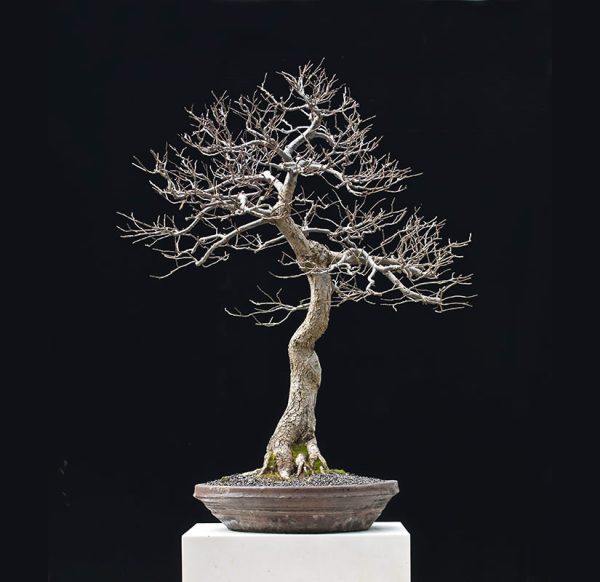
At what (x,y) coordinates should I click in order to perform the action: click on bonsai. Please return your answer as a coordinate pair (x, y). Looking at the image, I should click on (296, 333).